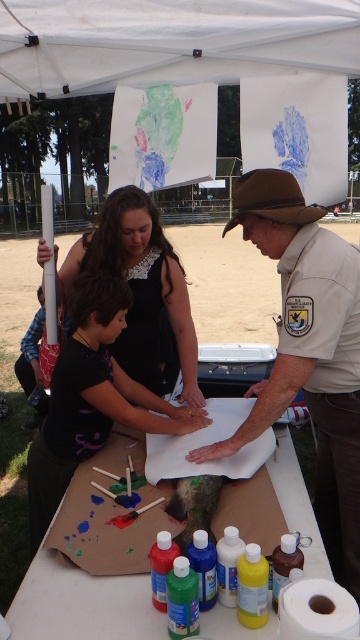
Looking at this image, between brown uniform at center and matte black dress at center, which one appears on the right side from the viewer's perspective?

brown uniform at center

Is brown uniform at center to the left of matte black dress at center from the viewer's perspective?

No, brown uniform at center is not to the left of matte black dress at center.

Who is more forward, (352,452) or (195,387)?

Positioned in front is point (352,452).

The image size is (360, 640). In order to click on brown uniform at center in this screenshot , I will do `click(308, 352)`.

The height and width of the screenshot is (640, 360). What do you see at coordinates (308, 352) in the screenshot?
I see `brown uniform at center` at bounding box center [308, 352].

Which is behind, point (212, 444) or point (174, 416)?

The point (174, 416) is more distant.

Where is `brown uniform at center`? The height and width of the screenshot is (640, 360). brown uniform at center is located at coordinates (308, 352).

From the picture: Is matte black shirt at center smaller than matte black dress at center?

Yes.

Does matte black shirt at center appear under matte black dress at center?

Yes.

Is point (177, 406) positioned behind point (173, 289)?

No, (177, 406) is closer to viewer.

Identify the location of matte black shirt at center. The width and height of the screenshot is (360, 640). (91, 400).